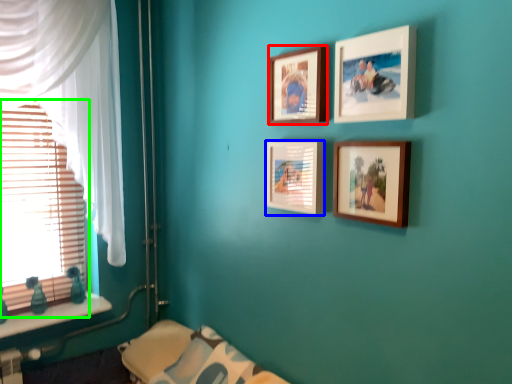
Question: Which object is the farthest from picture frame (highlighted by a red box)? Choose among these: picture frame (highlighted by a blue box) or window blind (highlighted by a green box).

Choices:
 (A) picture frame
 (B) window blind

Answer: (B)